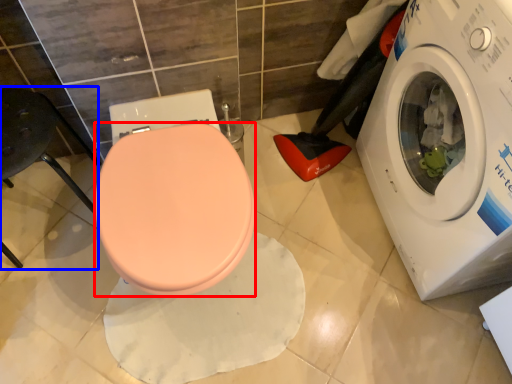
Question: Which of the following is the farthest to the observer, bidet (highlighted by a red box) or chair (highlighted by a blue box)?

Choices:
 (A) bidet
 (B) chair

Answer: (B)